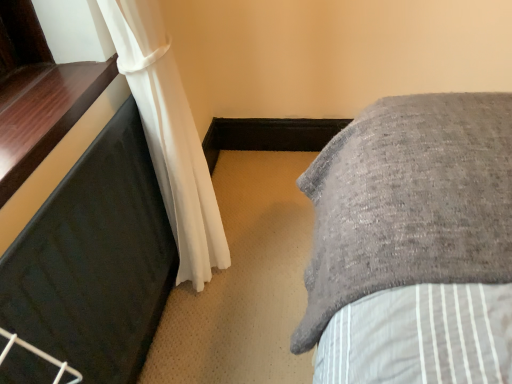
Question: Is black rubber mat at left thinner than white sheer curtain at left?

Choices:
 (A) yes
 (B) no

Answer: (A)

Question: Does black rubber mat at left come behind white sheer curtain at left?

Choices:
 (A) no
 (B) yes

Answer: (A)

Question: Considering the relative sizes of black rubber mat at left and white sheer curtain at left in the image provided, is black rubber mat at left taller than white sheer curtain at left?

Choices:
 (A) no
 (B) yes

Answer: (A)

Question: Considering the relative sizes of black rubber mat at left and white sheer curtain at left in the image provided, is black rubber mat at left smaller than white sheer curtain at left?

Choices:
 (A) yes
 (B) no

Answer: (A)

Question: From a real-world perspective, is black rubber mat at left over white sheer curtain at left?

Choices:
 (A) no
 (B) yes

Answer: (A)

Question: Considering the positions of black glossy window sill at left and white sheer curtain at left in the image, is black glossy window sill at left bigger or smaller than white sheer curtain at left?

Choices:
 (A) big
 (B) small

Answer: (B)

Question: Would you say black glossy window sill at left is to the left or to the right of white sheer curtain at left in the picture?

Choices:
 (A) right
 (B) left

Answer: (B)

Question: Is black glossy window sill at left spatially inside white sheer curtain at left, or outside of it?

Choices:
 (A) outside
 (B) inside

Answer: (A)

Question: Is black glossy window sill at left taller or shorter than white sheer curtain at left?

Choices:
 (A) tall
 (B) short

Answer: (B)

Question: Considering their positions, is white sheer curtain at left located in front of or behind black rubber mat at left?

Choices:
 (A) behind
 (B) front

Answer: (A)

Question: In terms of height, does white sheer curtain at left look taller or shorter compared to black rubber mat at left?

Choices:
 (A) tall
 (B) short

Answer: (A)

Question: From the image's perspective, is white sheer curtain at left positioned above or below black rubber mat at left?

Choices:
 (A) above
 (B) below

Answer: (A)

Question: Do you think white sheer curtain at left is within black rubber mat at left, or outside of it?

Choices:
 (A) outside
 (B) inside

Answer: (A)

Question: Is black glossy window sill at left bigger or smaller than black rubber mat at left?

Choices:
 (A) big
 (B) small

Answer: (B)

Question: Looking at their shapes, would you say black glossy window sill at left is wider or thinner than black rubber mat at left?

Choices:
 (A) thin
 (B) wide

Answer: (B)